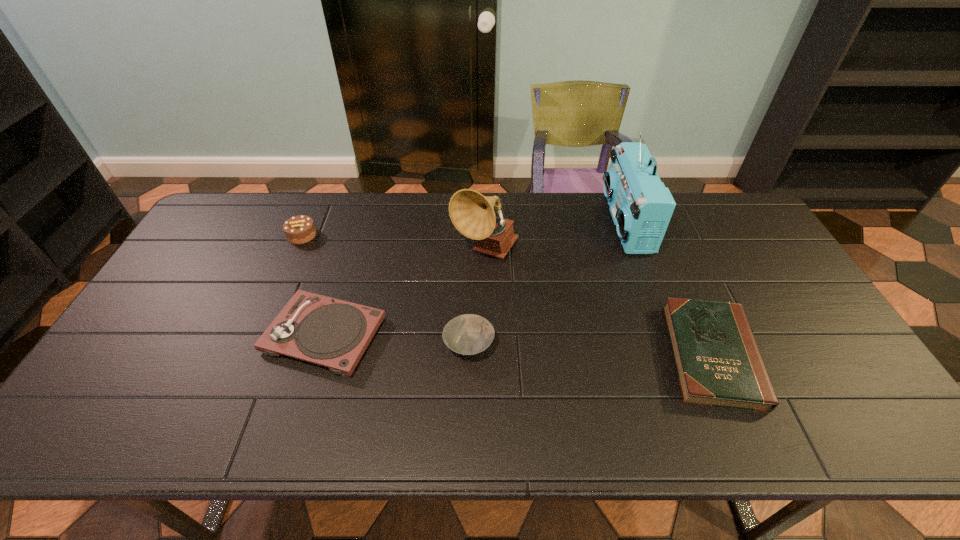
Image resolution: width=960 pixels, height=540 pixels. In the image, there is a desktop. What are the coordinates of `free space at the far edge` in the screenshot? It's located at (554, 198).

The width and height of the screenshot is (960, 540). What are the coordinates of `vacant region at the right edge of the desktop` in the screenshot? It's located at (730, 268).

In the image, there is a desktop. Where is `free space at the far left corner`? This screenshot has height=540, width=960. free space at the far left corner is located at coordinates (241, 235).

Locate an element on the screen. The height and width of the screenshot is (540, 960). vacant space at the near left corner of the desktop is located at coordinates (79, 426).

Image resolution: width=960 pixels, height=540 pixels. Identify the location of vacant area that lies between the radio receiver and the Bible. (668, 289).

Find the location of a particular element. This screenshot has height=540, width=960. vacant space in between the bowl and the chocolate cake is located at coordinates (385, 289).

Where is `empty space that is in between the Bible and the chocolate cake`? The height and width of the screenshot is (540, 960). empty space that is in between the Bible and the chocolate cake is located at coordinates (507, 295).

You are a GUI agent. You are given a task and a screenshot of the screen. Output one action in this format:
    pyautogui.click(x=<x>, y=<y>)
    Task: Click on the free space between the bowl and the radio receiver
    
    Given the screenshot: What is the action you would take?
    pyautogui.click(x=547, y=284)

Where is `empty space that is in between the chocolate cake and the nearer phonograph_record`? empty space that is in between the chocolate cake and the nearer phonograph_record is located at coordinates (313, 285).

The image size is (960, 540). In order to click on free spot between the chocolate cake and the right phonograph_record in this screenshot , I will do `click(394, 243)`.